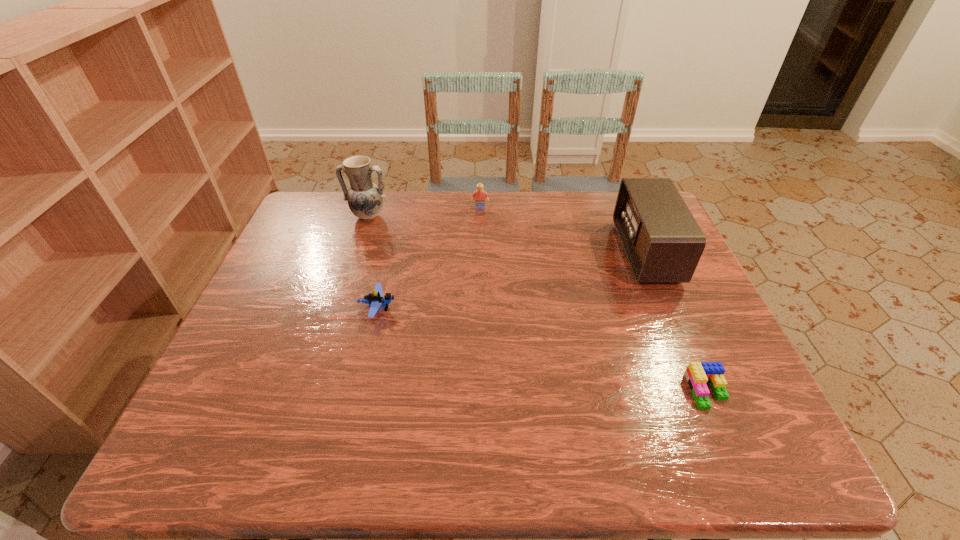
Find the location of a particular element. The width and height of the screenshot is (960, 540). vacant space that is in between the tallest object and the tallest Lego is located at coordinates (424, 212).

What are the coordinates of `free spot between the pottery and the nearest object` in the screenshot? It's located at 538,303.

Identify the location of empty space between the pottery and the leftmost Lego. (373, 262).

You are a GUI agent. You are given a task and a screenshot of the screen. Output one action in this format:
    pyautogui.click(x=<x>, y=<y>)
    Task: Click on the vacant space that's between the radio receiver and the second Lego from right to left
    
    Given the screenshot: What is the action you would take?
    pyautogui.click(x=563, y=231)

In order to click on empty location between the fourth shortest object and the shortest Lego in this screenshot , I will do `click(677, 322)`.

This screenshot has height=540, width=960. I want to click on empty space between the radio receiver and the fourth tallest object, so click(x=512, y=281).

You are a GUI agent. You are given a task and a screenshot of the screen. Output one action in this format:
    pyautogui.click(x=<x>, y=<y>)
    Task: Click on the vacant area that lies between the radio receiver and the pottery
    
    Given the screenshot: What is the action you would take?
    pyautogui.click(x=507, y=234)

This screenshot has width=960, height=540. What are the coordinates of `free area in between the third object from right to left and the shortest object` in the screenshot? It's located at (593, 300).

At what (x,y) coordinates should I click in order to perform the action: click on object that is the second closest to the second tallest object. Please return your answer as a coordinate pair (x, y). Looking at the image, I should click on (479, 195).

Identify the location of the fourth closest object relative to the nearest Lego. (365, 199).